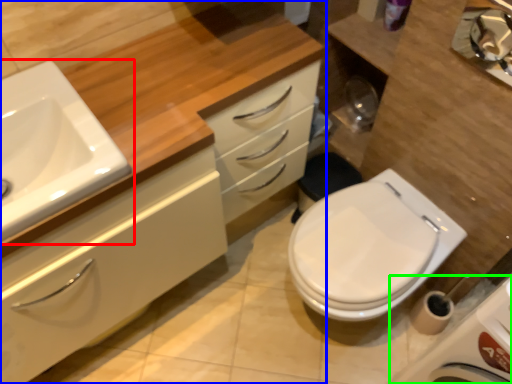
Question: Considering the real-world distances, which object is farthest from sink (highlighted by a red box)? bathroom cabinet (highlighted by a blue box) or porcelain (highlighted by a green box)?

Choices:
 (A) bathroom cabinet
 (B) porcelain

Answer: (B)